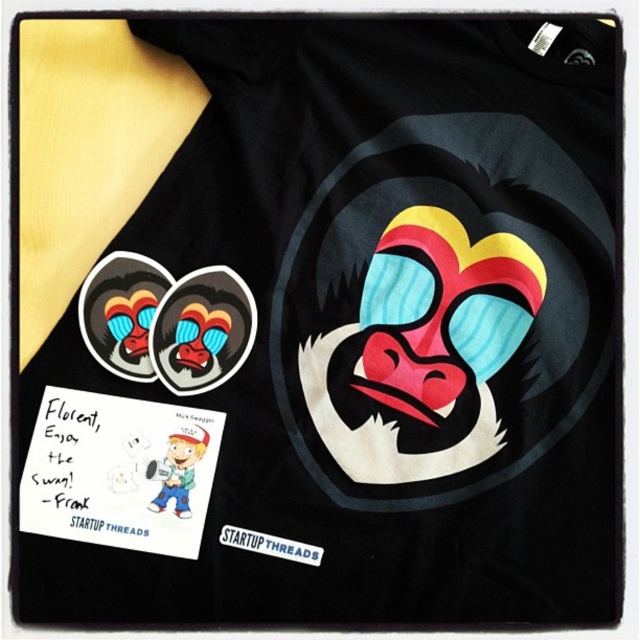
Question: Is matte rubber monkey face at upper left wider than white matte sticker at center?

Choices:
 (A) yes
 (B) no

Answer: (A)

Question: Which is farther from the white paper at upper left?

Choices:
 (A) white matte sticker at center
 (B) matte rubber monkey face at upper left

Answer: (A)

Question: Can you confirm if white paper at upper left is thinner than white matte sticker at center?

Choices:
 (A) yes
 (B) no

Answer: (B)

Question: Which object appears closest to the camera in this image?

Choices:
 (A) matte rubber monkey face at upper left
 (B) white matte sticker at center

Answer: (B)

Question: Does matte rubber monkey face at upper left lie behind white matte sticker at center?

Choices:
 (A) yes
 (B) no

Answer: (A)

Question: Which point is farther to the camera?

Choices:
 (A) white matte sticker at center
 (B) white paper at upper left
 (C) matte rubber monkey face at upper left

Answer: (C)